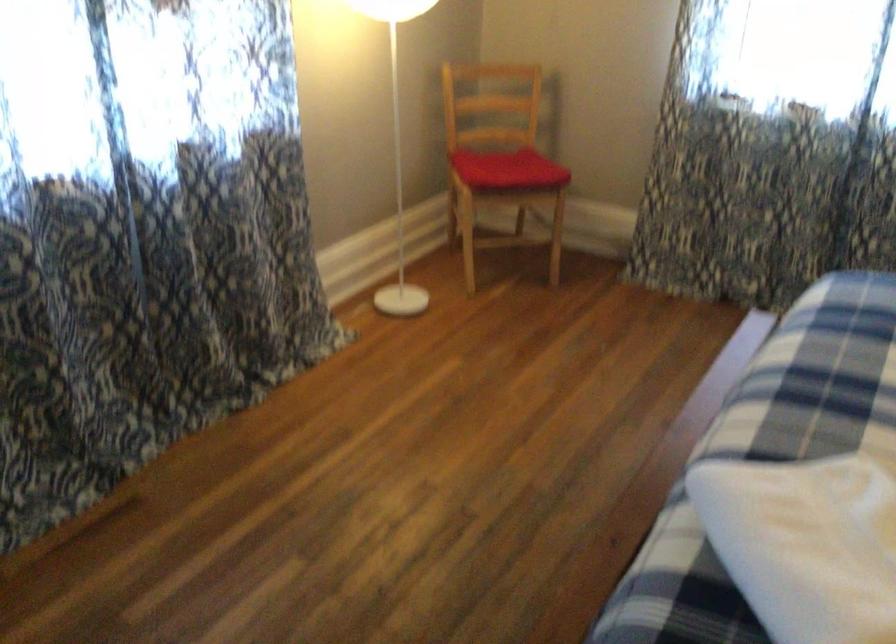
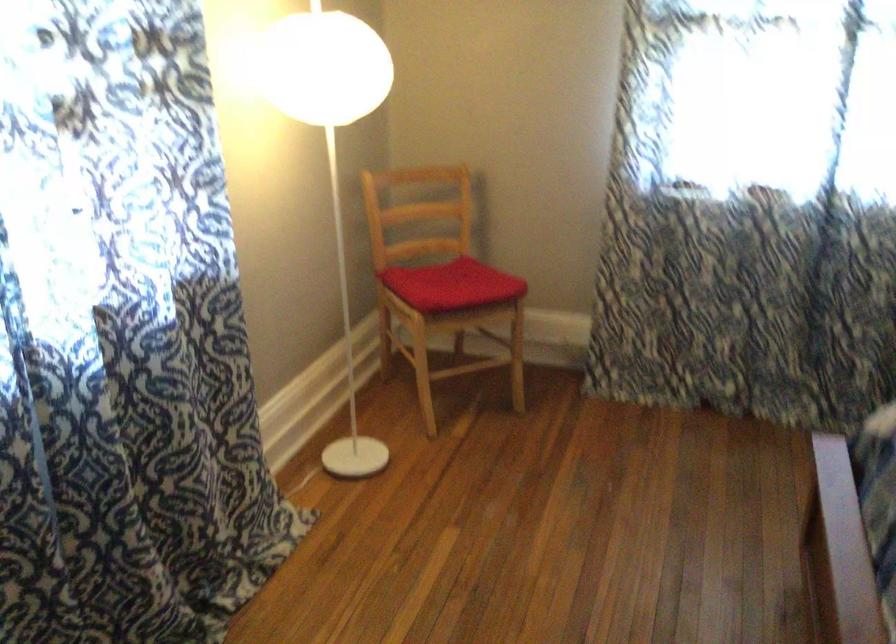
Which direction would the cameraman need to move to produce the second image?

The movement direction of the cameraman is left, forward.